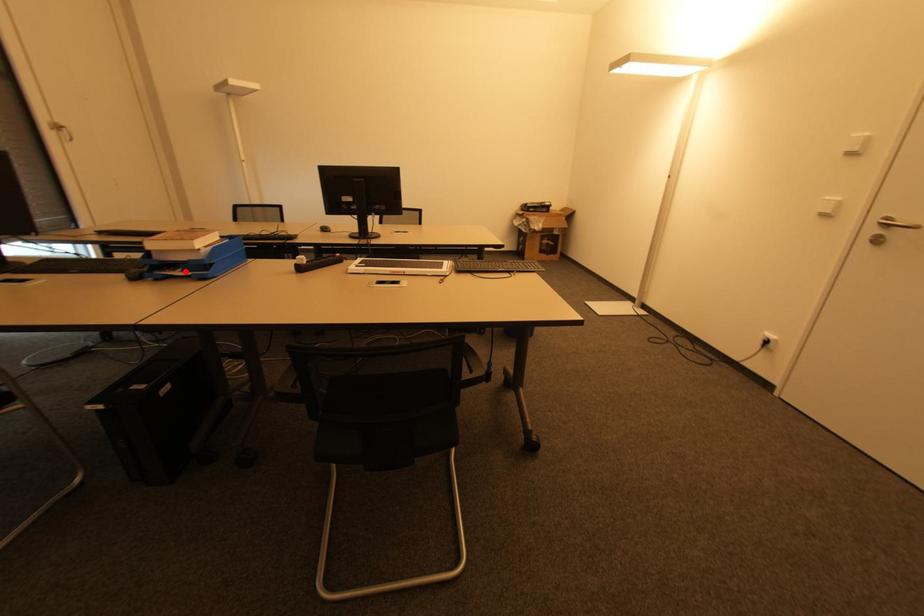
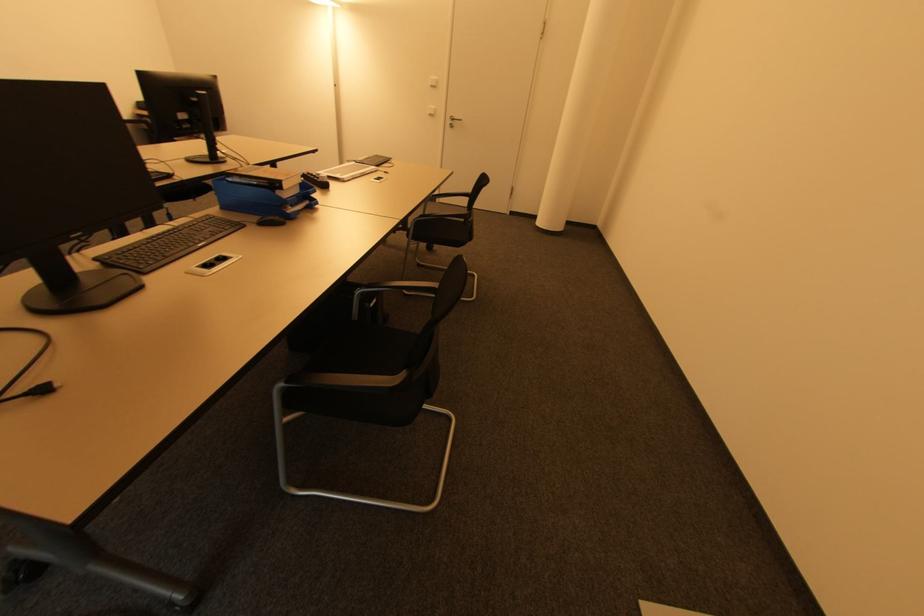
Where in the second image is the point corresponding to the highlighted location from the first image?

(294, 207)